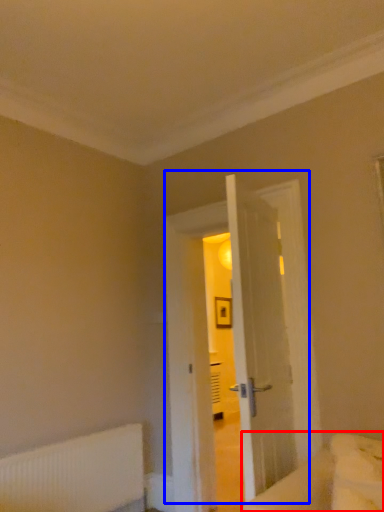
Question: Which of the following is the closest to the observer, bed (highlighted by a red box) or door (highlighted by a blue box)?

Choices:
 (A) bed
 (B) door

Answer: (A)